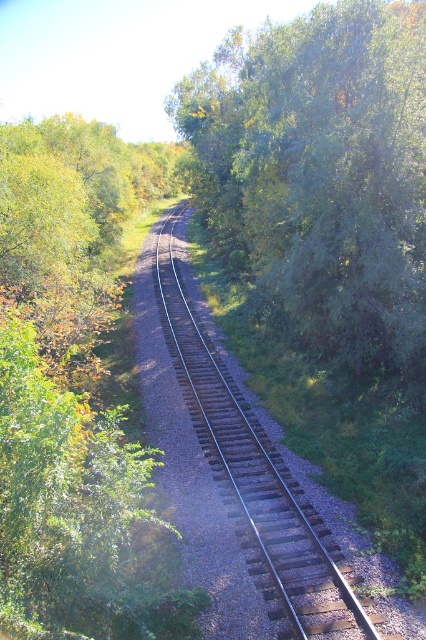
Which is behind, point (331, 106) or point (347, 592)?

The point (331, 106) is more distant.

Does green leafy tree at center lie in front of brown gravel track at center?

No.

Which is in front, point (368, 260) or point (293, 561)?

Point (293, 561) is in front.

Locate an element on the screen. green leafy tree at center is located at coordinates (321, 179).